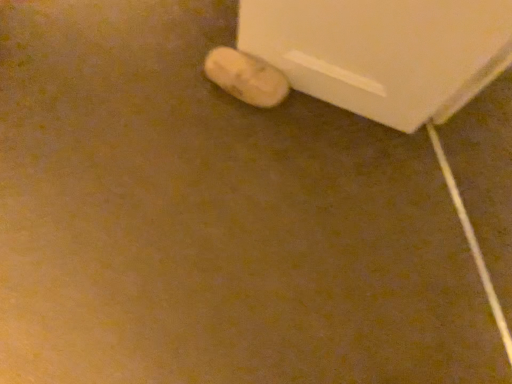
Find the location of a particular element. beige suede shoe at lower right is located at coordinates (246, 77).

This screenshot has height=384, width=512. What do you see at coordinates (246, 77) in the screenshot?
I see `beige suede shoe at lower right` at bounding box center [246, 77].

The image size is (512, 384). I want to click on beige suede shoe at lower right, so click(x=246, y=77).